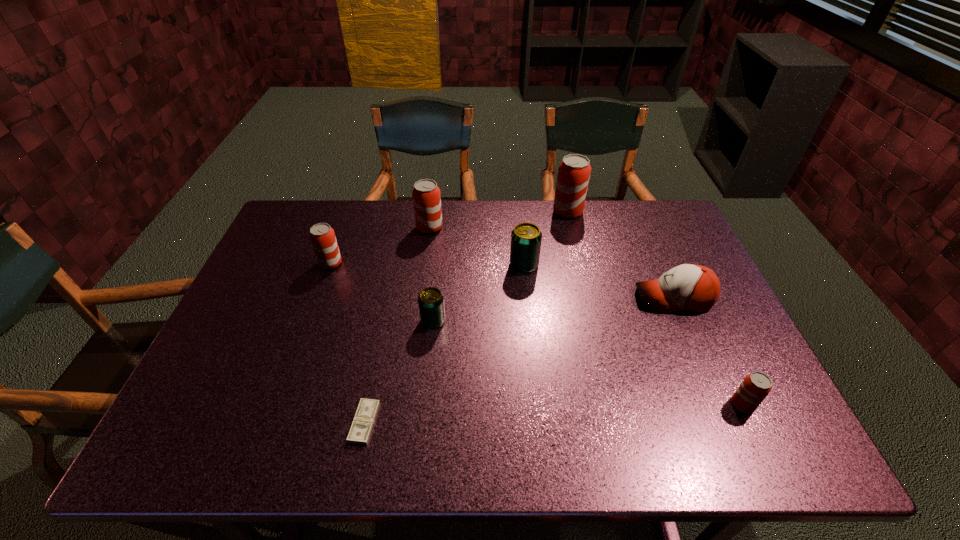
In the image, there is a desktop. Identify the location of vacant space at the left edge. The width and height of the screenshot is (960, 540). (192, 398).

Image resolution: width=960 pixels, height=540 pixels. In the image, there is a desktop. What are the coordinates of `vacant space at the far left corner` in the screenshot? It's located at (322, 214).

Find the location of a particular element. vacant space at the near left corner of the desktop is located at coordinates (184, 427).

Identify the location of free space at the far right corner of the desktop. (639, 226).

Where is `free space between the third orange beer can from left to right and the nearer green beer can`? free space between the third orange beer can from left to right and the nearer green beer can is located at coordinates (500, 266).

Where is `empty space between the nearer green beer can and the shortest object`? This screenshot has width=960, height=540. empty space between the nearer green beer can and the shortest object is located at coordinates (398, 372).

The height and width of the screenshot is (540, 960). What are the coordinates of `vacant area between the shortest object and the leftmost object` in the screenshot? It's located at (348, 343).

Locate an element on the screen. empty space that is in between the biggest orange beer can and the shortest object is located at coordinates (467, 317).

Identify the location of free spot between the nearer green beer can and the second object from left to right. The image size is (960, 540). (398, 372).

This screenshot has width=960, height=540. Find the location of `free space between the third biggest orange beer can and the fifth beer can from left to right`. free space between the third biggest orange beer can and the fifth beer can from left to right is located at coordinates (449, 238).